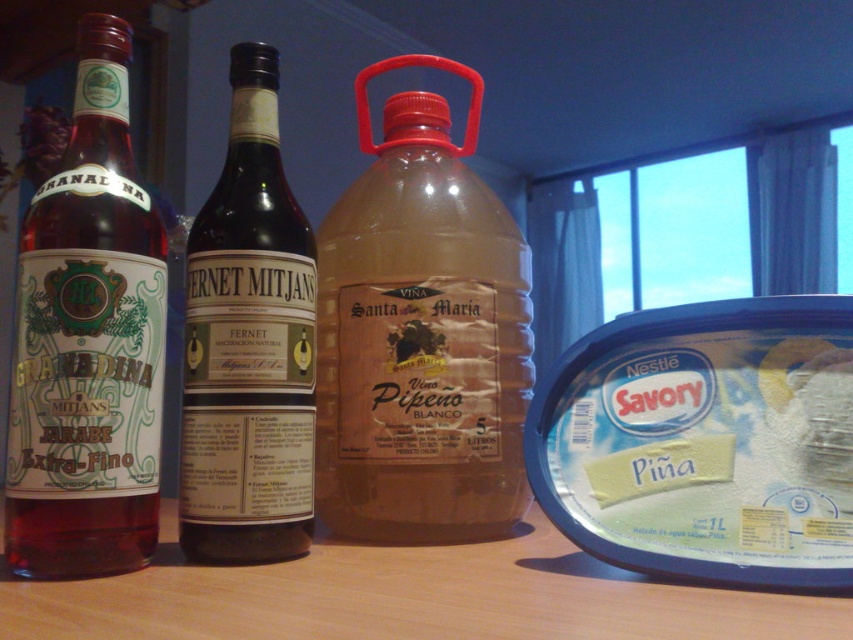
Question: Does translucent plastic bottle at center appear over dark glass bottle at center?

Choices:
 (A) yes
 (B) no

Answer: (A)

Question: In this image, where is translucent plastic bottle at center located relative to matte glass bottle at left?

Choices:
 (A) right
 (B) left

Answer: (A)

Question: Which point is closer to the camera taking this photo?

Choices:
 (A) (86, 77)
 (B) (392, 497)

Answer: (A)

Question: Which of the following is the farthest from the observer?

Choices:
 (A) matte glass bottle at left
 (B) translucent plastic bottle at center
 (C) dark glass bottle at center

Answer: (B)

Question: Which is farther from the translucent plastic bottle at center?

Choices:
 (A) dark glass bottle at center
 (B) matte glass bottle at left

Answer: (B)

Question: Can you confirm if matte glass bottle at left is smaller than dark glass bottle at center?

Choices:
 (A) no
 (B) yes

Answer: (A)